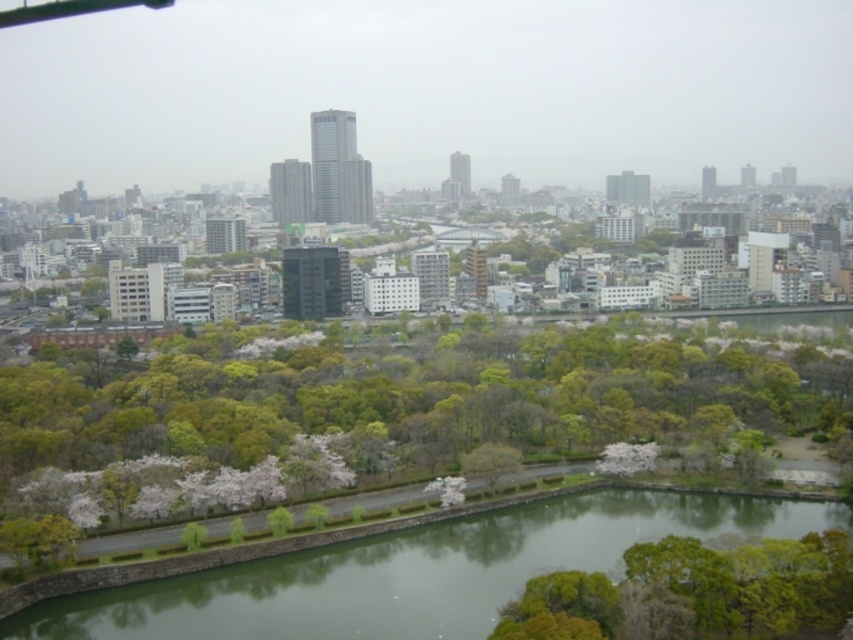
Question: Is green leafy tree at center closer to camera compared to green leafy tree at lower right?

Choices:
 (A) no
 (B) yes

Answer: (A)

Question: Can you confirm if green smooth water at center is smaller than green leafy tree at lower right?

Choices:
 (A) no
 (B) yes

Answer: (A)

Question: Which is farther from the green leafy tree at center?

Choices:
 (A) green leafy tree at lower right
 (B) green smooth water at center

Answer: (A)

Question: Which point is closer to the camera taking this photo?

Choices:
 (A) (561, 616)
 (B) (473, 356)

Answer: (A)

Question: Among these objects, which one is farthest from the camera?

Choices:
 (A) green leafy tree at lower right
 (B) green leafy tree at center

Answer: (B)

Question: Can you confirm if green leafy tree at center is bigger than green smooth water at center?

Choices:
 (A) no
 (B) yes

Answer: (B)